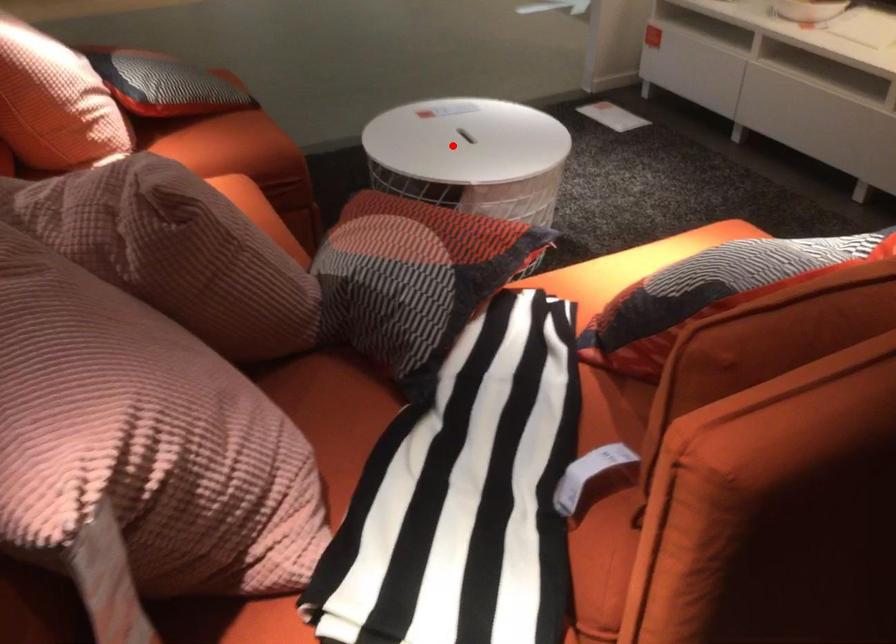
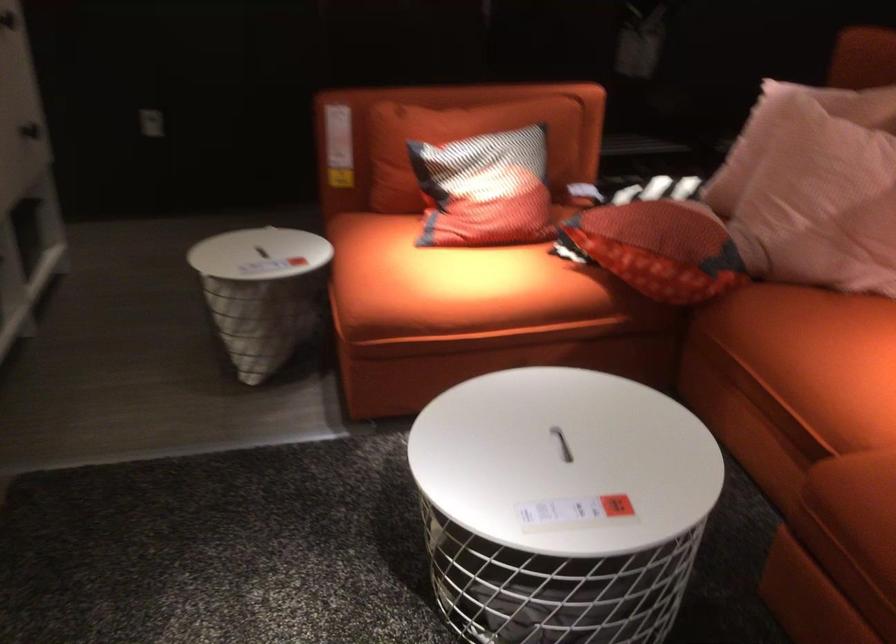
The point at the highlighted location is marked in the first image. Where is the corresponding point in the second image?

(562, 444)